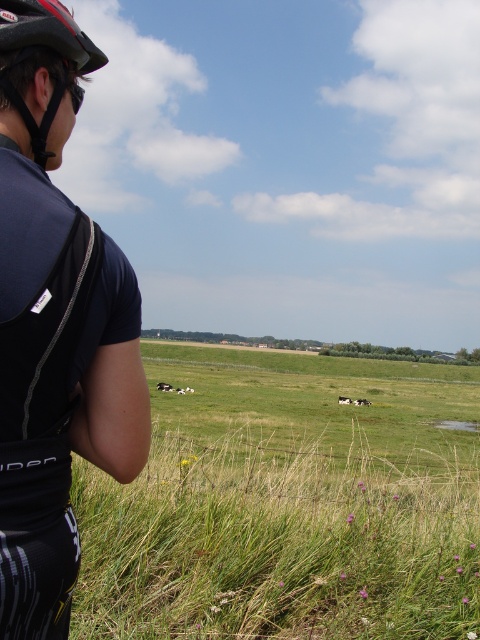
Question: Is matte black cycling jersey at left positioned in front of matte black helmet at upper left?

Choices:
 (A) no
 (B) yes

Answer: (B)

Question: Is matte black cycling jersey at left bigger than matte black helmet at upper left?

Choices:
 (A) yes
 (B) no

Answer: (A)

Question: Which point is closer to the camera?

Choices:
 (A) (88, 420)
 (B) (68, 20)

Answer: (B)

Question: Does matte black cycling jersey at left lie behind matte black helmet at upper left?

Choices:
 (A) yes
 (B) no

Answer: (B)